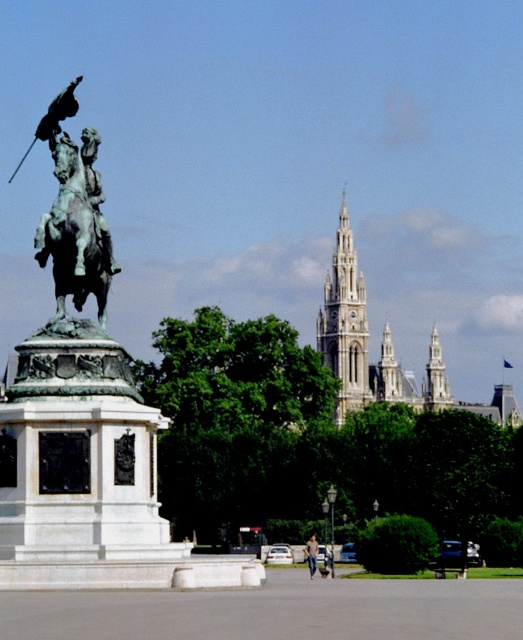
Does bronze statue at left have a lesser height compared to green patina horse at center?

Incorrect, bronze statue at left's height does not fall short of green patina horse at center's.

In the scene shown: Can you confirm if bronze statue at left is thinner than green patina horse at center?

No, bronze statue at left is not thinner than green patina horse at center.

Who is more distant from viewer, (65, 179) or (93, 160)?

Point (93, 160)

Where is `bronze statue at left`? This screenshot has width=523, height=640. bronze statue at left is located at coordinates point(77,397).

Can you confirm if bronze statue at left is positioned below dark blue jeans at center?

Actually, bronze statue at left is above dark blue jeans at center.

The width and height of the screenshot is (523, 640). I want to click on bronze statue at left, so click(x=77, y=397).

Is point (40, 132) closer to camera compared to point (316, 554)?

That is True.

Locate an element on the screen. The image size is (523, 640). bronze statue at left is located at coordinates (77, 397).

Does green patina horse at center have a larger size compared to dark blue jeans at center?

No.

Does green patina horse at center appear under dark blue jeans at center?

Incorrect, green patina horse at center is not positioned below dark blue jeans at center.

Image resolution: width=523 pixels, height=640 pixels. Identify the location of green patina horse at center. (76, 227).